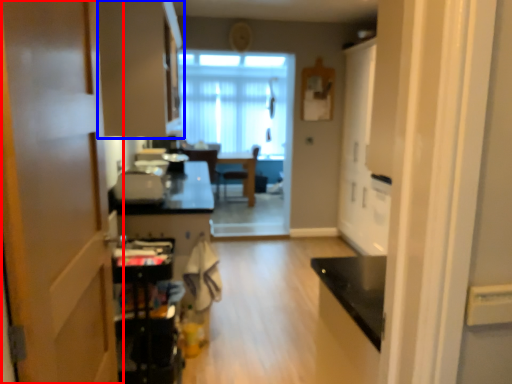
Question: Which object is further to the camera taking this photo, door (highlighted by a red box) or cabinetry (highlighted by a blue box)?

Choices:
 (A) door
 (B) cabinetry

Answer: (B)